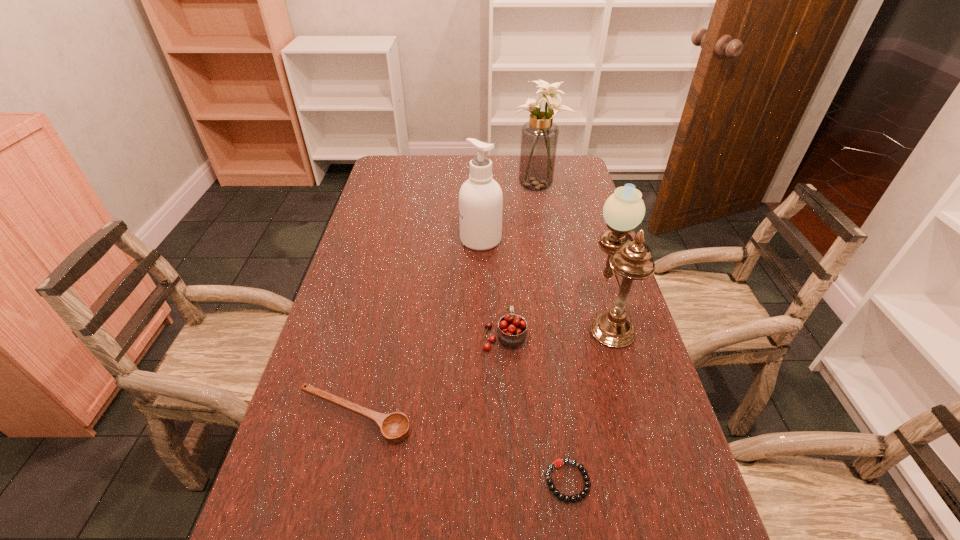
Find the location of `free spot between the fourth tallest object and the cleansing agent`. free spot between the fourth tallest object and the cleansing agent is located at coordinates (492, 288).

The image size is (960, 540). Find the location of `blank region between the cleansing agent and the farthest object`. blank region between the cleansing agent and the farthest object is located at coordinates (509, 212).

What are the coordinates of `empty space between the fourth tallest object and the oil lamp` in the screenshot? It's located at (556, 325).

Where is `unoccupied position between the shortest object and the fifth tallest object`? This screenshot has width=960, height=540. unoccupied position between the shortest object and the fifth tallest object is located at coordinates pos(461,449).

Identify the location of vacant area between the cleansing agent and the bracelet. The image size is (960, 540). (524, 360).

In order to click on free area in between the third shortest object and the nearest object in this screenshot , I will do `click(536, 408)`.

This screenshot has width=960, height=540. In order to click on free point between the second farthest object and the wooden spoon in this screenshot , I will do (x=418, y=328).

Image resolution: width=960 pixels, height=540 pixels. I want to click on empty space that is in between the cherry and the oil lamp, so click(x=556, y=325).

Locate an element on the screen. The image size is (960, 540). object that stands as the third closest to the cleansing agent is located at coordinates (511, 332).

Find the location of a particular element. The width and height of the screenshot is (960, 540). object that stands as the fifth closest to the bracelet is located at coordinates (539, 136).